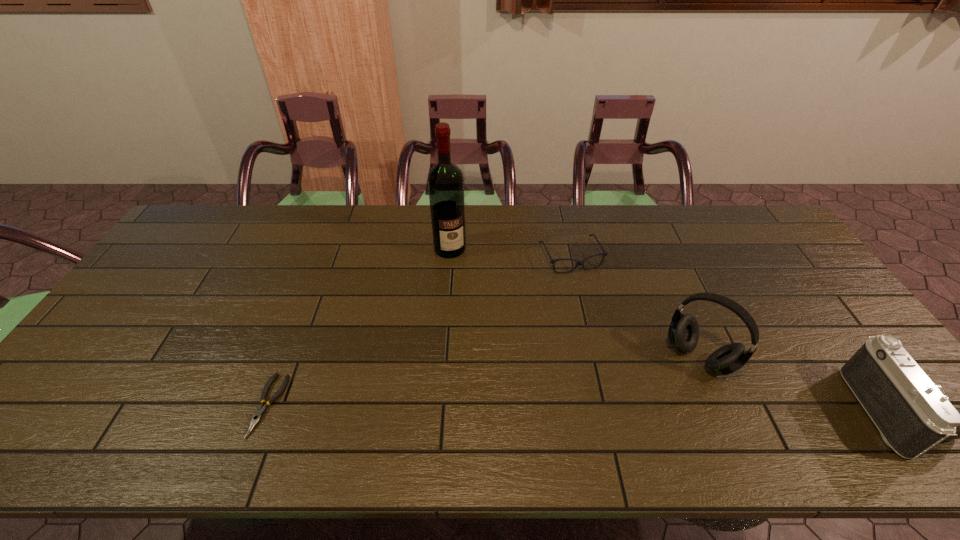
This screenshot has width=960, height=540. What are the coordinates of `vacant region located on the front-facing side of the third object from right to left` in the screenshot? It's located at [x=612, y=330].

The height and width of the screenshot is (540, 960). In order to click on vacant area situated on the front-facing side of the third object from right to left in this screenshot , I will do `click(594, 299)`.

Find the location of a particular element. The height and width of the screenshot is (540, 960). free location located on the ear cups of the fourth object from left to right is located at coordinates (671, 392).

Locate an element on the screen. vacant region located 0.110m on the ear cups of the fourth object from left to right is located at coordinates (660, 404).

I want to click on vacant space located on the front and back of the alcohol, so click(480, 319).

The width and height of the screenshot is (960, 540). In order to click on free region located on the front and back of the alcohol in this screenshot , I will do `click(483, 325)`.

What are the coordinates of `blank area located 0.110m on the front and back of the alcohol` in the screenshot? It's located at (464, 281).

Locate an element on the screen. This screenshot has height=540, width=960. spectacles present at the far edge is located at coordinates (604, 253).

This screenshot has height=540, width=960. In order to click on alcohol present at the far edge in this screenshot , I will do `click(445, 179)`.

Find the location of a particular element. The height and width of the screenshot is (540, 960). pliers that is at the near edge is located at coordinates (257, 416).